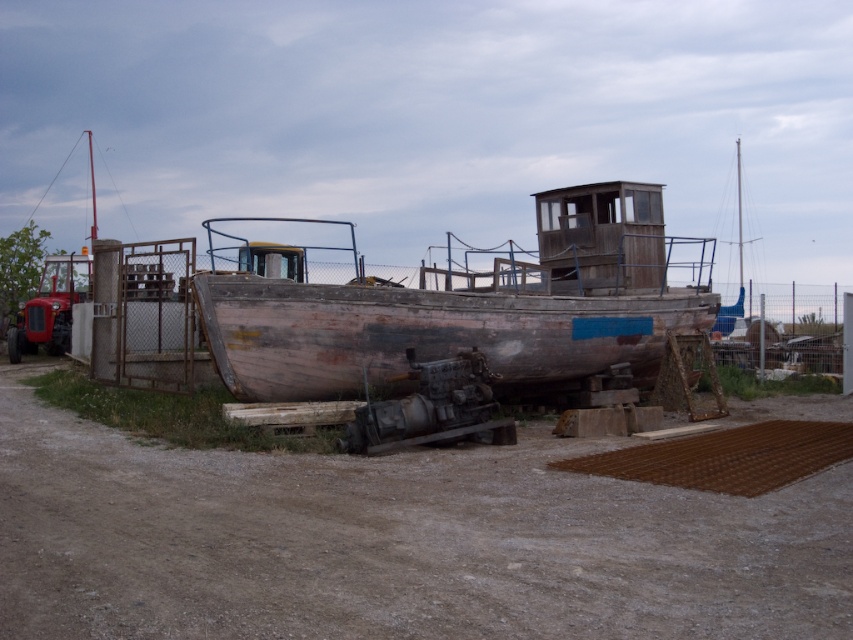
Does brown dirt track at center appear over rusty wood boat at center?

No.

Does brown dirt track at center come behind rusty wood boat at center?

No, brown dirt track at center is in front of rusty wood boat at center.

Which is behind, point (39, 468) or point (640, 224)?

The point (640, 224) is more distant.

At what (x,y) coordinates should I click in order to perform the action: click on brown dirt track at center. Please return your answer as a coordinate pair (x, y). This screenshot has height=640, width=853. Looking at the image, I should click on (395, 541).